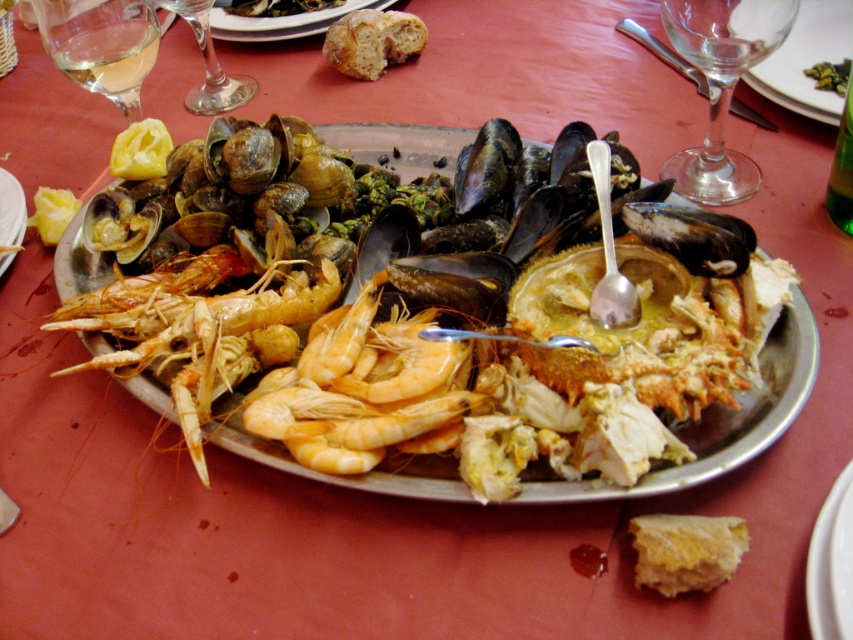
Question: Can you confirm if transparent glass wine glass at upper right is smaller than bread at upper center?

Choices:
 (A) yes
 (B) no

Answer: (B)

Question: Among these points, which one is nearest to the camera?

Choices:
 (A) (305, 369)
 (B) (631, 28)
 (C) (811, 328)

Answer: (A)

Question: Is shiny silver platter at center wider than shiny orange shrimp at center?

Choices:
 (A) yes
 (B) no

Answer: (A)

Question: Can you confirm if transparent glass wine glass at upper right is positioned to the left of transparent glass at upper center?

Choices:
 (A) no
 (B) yes

Answer: (A)

Question: Which point is farther to the camera?

Choices:
 (A) white ceramic plate at center
 (B) metallic silver platter at center

Answer: (B)

Question: Estimate the real-world distances between objects in this image. Which object is farther from the transparent glass wine glass at upper right?

Choices:
 (A) metallic silver platter at center
 (B) transparent glass wine glass at upper left
 (C) metal spoon at upper center

Answer: (B)